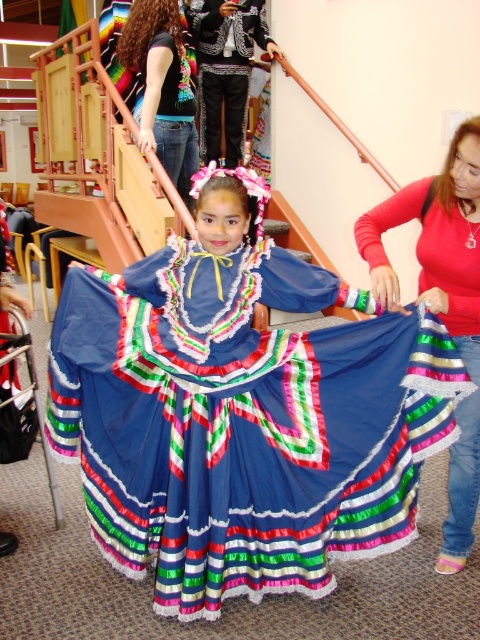
Question: Considering the real-world distances, which object is farthest from the matte blue skirt at center?

Choices:
 (A) jeans at upper left
 (B) blue satin dress at center
 (C) embroidered velvet vest at upper center

Answer: (C)

Question: Which point is farther to the camera?

Choices:
 (A) matte blue skirt at center
 (B) embroidered velvet vest at upper center
 (C) jeans at upper left
 (D) blue satin dress at center

Answer: (B)

Question: Is jeans at upper left thinner than embroidered velvet vest at upper center?

Choices:
 (A) yes
 (B) no

Answer: (A)

Question: Can you confirm if matte blue skirt at center is wider than embroidered velvet vest at upper center?

Choices:
 (A) yes
 (B) no

Answer: (B)

Question: Which point appears farthest from the camera in this image?

Choices:
 (A) (475, 225)
 (B) (126, 499)
 (C) (228, 80)
 (D) (180, 48)

Answer: (C)

Question: Does matte blue skirt at center have a larger size compared to embroidered velvet vest at upper center?

Choices:
 (A) no
 (B) yes

Answer: (A)